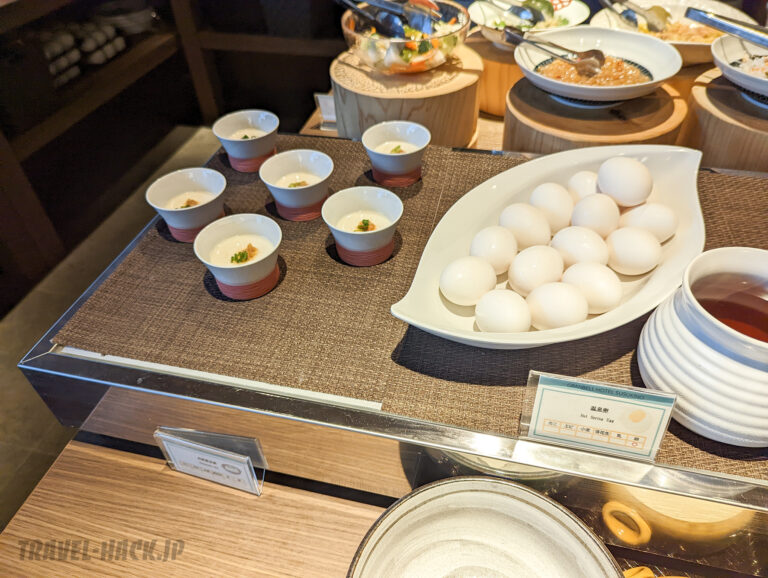
Locate an element on the screen. small serving dish is located at coordinates (174, 205).